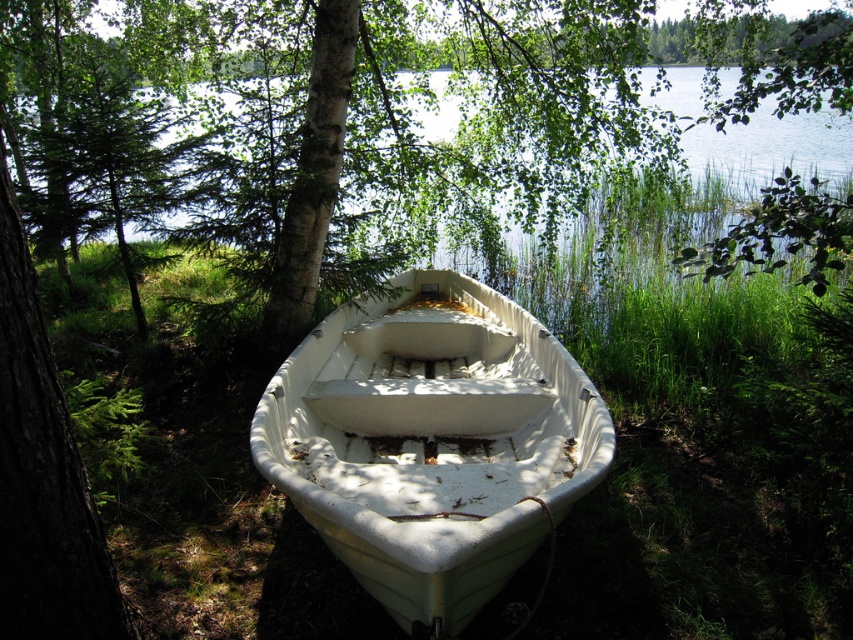
Can you confirm if white matte boat at center is shorter than transparent water at center?

Yes, white matte boat at center is shorter than transparent water at center.

Is point (357, 513) more distant than point (799, 129)?

No, (357, 513) is closer to viewer.

Which is behind, point (521, 364) or point (704, 144)?

Point (704, 144)

Find the location of a particular element. white matte boat at center is located at coordinates (431, 442).